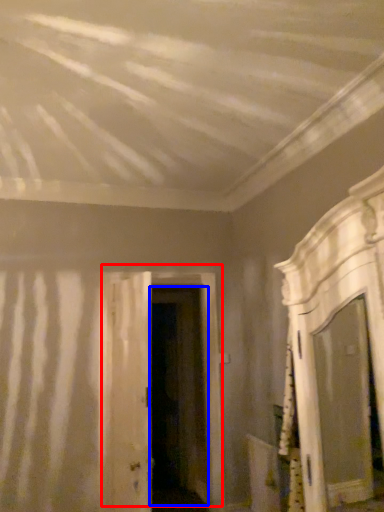
Question: Which point is further to the camera, door (highlighted by a red box) or door (highlighted by a blue box)?

Choices:
 (A) door
 (B) door

Answer: (B)